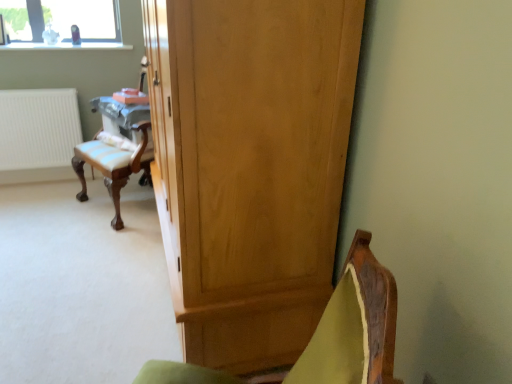
Question: Is light brown wood cupboard at center oriented away from velvet green chair at lower right?

Choices:
 (A) yes
 (B) no

Answer: (B)

Question: Is light brown wood cupboard at center aimed at velvet green chair at lower right?

Choices:
 (A) no
 (B) yes

Answer: (A)

Question: From a real-world perspective, is light brown wood cupboard at center positioned over velvet green chair at lower right based on gravity?

Choices:
 (A) no
 (B) yes

Answer: (B)

Question: Would you consider light brown wood cupboard at center to be distant from velvet green chair at lower right?

Choices:
 (A) yes
 (B) no

Answer: (B)

Question: From a real-world perspective, is light brown wood cupboard at center located beneath velvet green chair at lower right?

Choices:
 (A) no
 (B) yes

Answer: (A)

Question: From a real-world perspective, is white matte radiator at left physically located above or below velvet green chair at lower right?

Choices:
 (A) below
 (B) above

Answer: (A)

Question: Considering the positions of white matte radiator at left and velvet green chair at lower right in the image, is white matte radiator at left wider or thinner than velvet green chair at lower right?

Choices:
 (A) thin
 (B) wide

Answer: (A)

Question: Considering the positions of point (58, 112) and point (334, 327), is point (58, 112) closer or farther from the camera than point (334, 327)?

Choices:
 (A) closer
 (B) farther

Answer: (B)

Question: Considering the relative positions of white matte radiator at left and velvet green chair at lower right in the image provided, is white matte radiator at left to the left or to the right of velvet green chair at lower right?

Choices:
 (A) left
 (B) right

Answer: (A)

Question: Does point (229, 48) appear closer or farther from the camera than point (30, 142)?

Choices:
 (A) closer
 (B) farther

Answer: (A)

Question: From the image's perspective, is light brown wood cupboard at center positioned above or below white matte radiator at left?

Choices:
 (A) above
 (B) below

Answer: (B)

Question: From a real-world perspective, is light brown wood cupboard at center physically located above or below white matte radiator at left?

Choices:
 (A) above
 (B) below

Answer: (A)

Question: Based on their sizes in the image, would you say light brown wood cupboard at center is bigger or smaller than white matte radiator at left?

Choices:
 (A) big
 (B) small

Answer: (A)

Question: From a real-world perspective, is velvet green chair at lower right above or below white matte radiator at left?

Choices:
 (A) above
 (B) below

Answer: (A)

Question: Choose the correct answer: Is velvet green chair at lower right inside white matte radiator at left or outside it?

Choices:
 (A) inside
 (B) outside

Answer: (B)